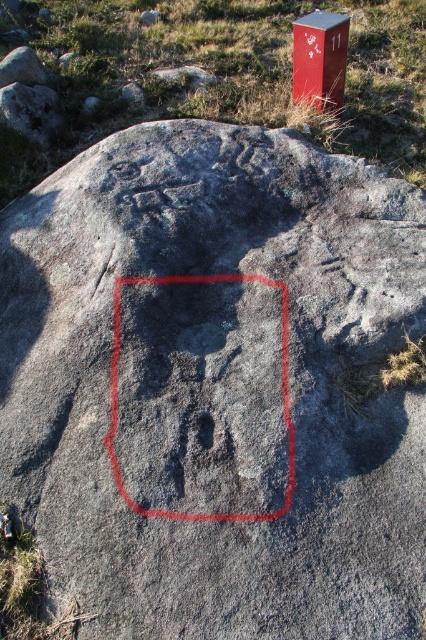
Question: Does gray stone carving at center appear under metallic red mailbox at upper right?

Choices:
 (A) no
 (B) yes

Answer: (B)

Question: Among these points, which one is farthest from the camera?

Choices:
 (A) (259, 276)
 (B) (322, 42)

Answer: (B)

Question: Among these objects, which one is nearest to the camera?

Choices:
 (A) gray stone carving at center
 (B) metallic red mailbox at upper right

Answer: (A)

Question: Can you confirm if gray stone carving at center is thinner than metallic red mailbox at upper right?

Choices:
 (A) yes
 (B) no

Answer: (B)

Question: Which of the following is the closest to the observer?

Choices:
 (A) (330, 58)
 (B) (158, 282)

Answer: (B)

Question: Can you confirm if gray stone carving at center is positioned below metallic red mailbox at upper right?

Choices:
 (A) no
 (B) yes

Answer: (B)